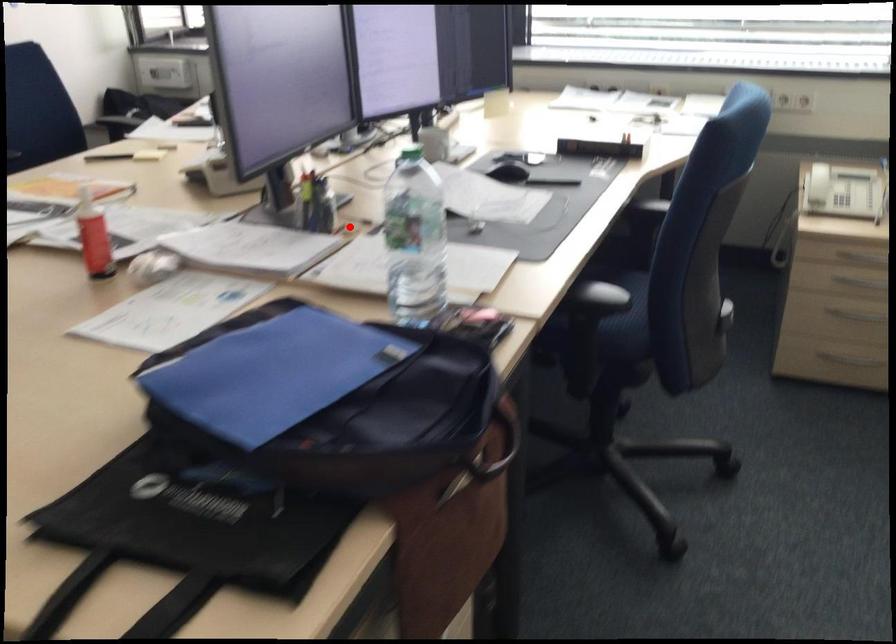
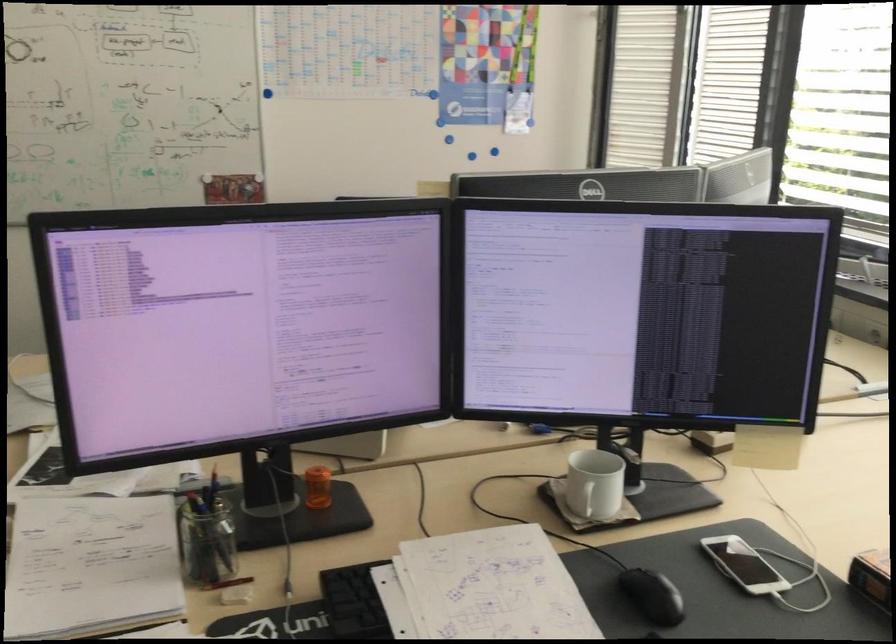
Question: I am providing you with two images of the same scene from different viewpoints. Image1 has a red point marked. In image2, the corresponding 3D location appears at what relative position? Reply with the corresponding letter.

Choices:
 (A) Closer
 (B) Farther

Answer: (A)